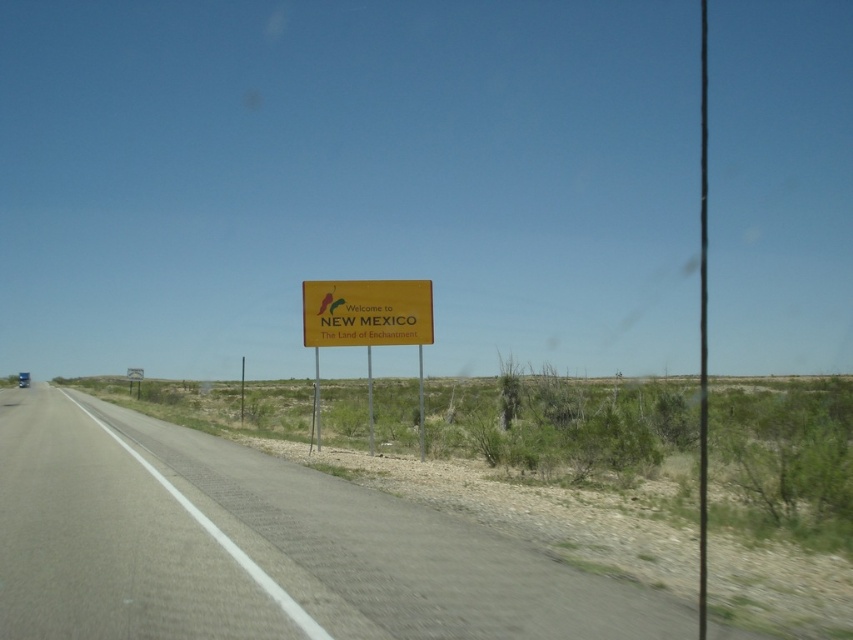
You are a driver approaching the gray asphalt road at center and the yellow matte sign at center. Which object is closer to you as you drive forward?

The gray asphalt road at center is closer to you because it is only 29.24 feet away from the yellow matte sign at center, meaning the road is in front of the sign.

You are a driver approaching the gray asphalt road at center and the yellow matte sign at center. Which object will appear bigger in your view as you get closer?

The gray asphalt road at center will appear bigger in your view as you get closer because it has a larger size compared to the yellow matte sign at center.

You are standing at the edge of the road looking towards the yellow welcome sign. There are two points marked on the sign. Which point, point (x=207, y=470) or point (x=401, y=339), is closer to you?

Point (x=207, y=470) is closer to you than point (x=401, y=339).